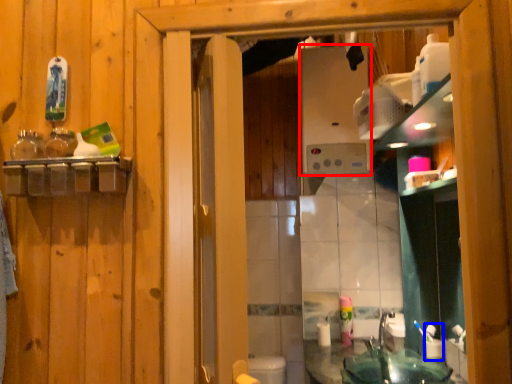
Question: Among these objects, which one is nearest to the camera, appliance (highlighted by a red box) or toiletry (highlighted by a blue box)?

Choices:
 (A) appliance
 (B) toiletry

Answer: (B)